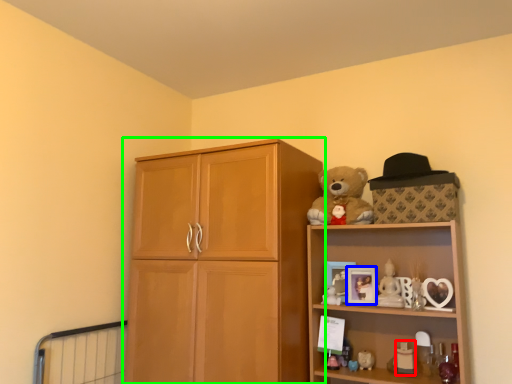
Question: Considering the real-world distances, which object is farthest from toy (highlighted by a red box)? picture frame (highlighted by a blue box) or cupboard (highlighted by a green box)?

Choices:
 (A) picture frame
 (B) cupboard

Answer: (B)